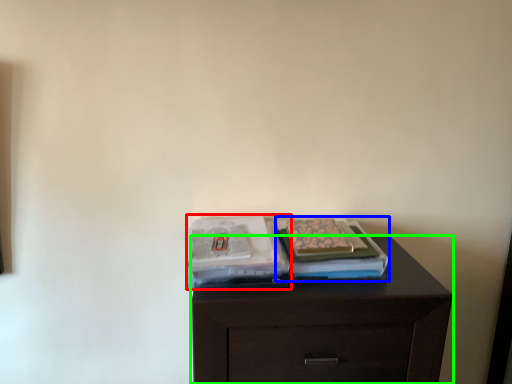
Question: Based on their relative distances, which object is farther from magazine (highlighted by a red box)? Choose from magazine (highlighted by a blue box) and chest of drawers (highlighted by a green box).

Choices:
 (A) magazine
 (B) chest of drawers

Answer: (B)